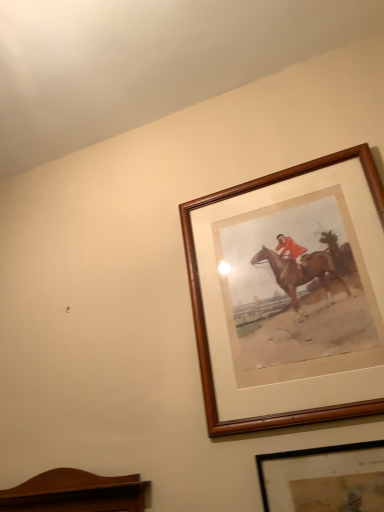
In order to click on black matte picture frame at lower right, positioned as the first picture frame in bottom-to-top order in this screenshot , I will do `click(324, 479)`.

Describe the element at coordinates (324, 479) in the screenshot. I see `black matte picture frame at lower right, acting as the 2th picture frame starting from the top` at that location.

Locate an element on the screen. The width and height of the screenshot is (384, 512). wooden picture frame at upper right, positioned as the second picture frame in bottom-to-top order is located at coordinates (204, 314).

Image resolution: width=384 pixels, height=512 pixels. What do you see at coordinates (204, 314) in the screenshot?
I see `wooden picture frame at upper right, which appears as the 1th picture frame when viewed from the top` at bounding box center [204, 314].

I want to click on black matte picture frame at lower right, acting as the 2th picture frame starting from the top, so click(x=324, y=479).

Is wooden picture frame at upper right, which appears as the 1th picture frame when viewed from the top, at the right side of black matte picture frame at lower right, acting as the 2th picture frame starting from the top?

No, wooden picture frame at upper right, which appears as the 1th picture frame when viewed from the top, is not to the right of black matte picture frame at lower right, acting as the 2th picture frame starting from the top.

Between wooden picture frame at upper right, which appears as the 1th picture frame when viewed from the top, and black matte picture frame at lower right, acting as the 2th picture frame starting from the top, which one is positioned behind?

wooden picture frame at upper right, which appears as the 1th picture frame when viewed from the top.

Is point (380, 206) farther from viewer compared to point (305, 511)?

Yes, point (380, 206) is farther from viewer.

From the image's perspective, which is above, wooden picture frame at upper right, which appears as the 1th picture frame when viewed from the top, or black matte picture frame at lower right, positioned as the first picture frame in bottom-to-top order?

wooden picture frame at upper right, which appears as the 1th picture frame when viewed from the top, from the image's perspective.

From a real-world perspective, who is located higher, wooden picture frame at upper right, positioned as the second picture frame in bottom-to-top order, or black matte picture frame at lower right, positioned as the first picture frame in bottom-to-top order?

From a 3D spatial view, wooden picture frame at upper right, positioned as the second picture frame in bottom-to-top order, is above.

Does wooden picture frame at upper right, which appears as the 1th picture frame when viewed from the top, have a greater width compared to black matte picture frame at lower right, acting as the 2th picture frame starting from the top?

Correct, the width of wooden picture frame at upper right, which appears as the 1th picture frame when viewed from the top, exceeds that of black matte picture frame at lower right, acting as the 2th picture frame starting from the top.

Is wooden picture frame at upper right, which appears as the 1th picture frame when viewed from the top, taller than black matte picture frame at lower right, positioned as the first picture frame in bottom-to-top order?

Correct, wooden picture frame at upper right, which appears as the 1th picture frame when viewed from the top, is much taller as black matte picture frame at lower right, positioned as the first picture frame in bottom-to-top order.

Which of these two, wooden picture frame at upper right, positioned as the second picture frame in bottom-to-top order, or black matte picture frame at lower right, positioned as the first picture frame in bottom-to-top order, is bigger?

With larger size is wooden picture frame at upper right, positioned as the second picture frame in bottom-to-top order.

Is wooden picture frame at upper right, which appears as the 1th picture frame when viewed from the top, inside or outside of black matte picture frame at lower right, acting as the 2th picture frame starting from the top?

wooden picture frame at upper right, which appears as the 1th picture frame when viewed from the top, exists outside the volume of black matte picture frame at lower right, acting as the 2th picture frame starting from the top.

Consider the image. Is wooden picture frame at upper right, positioned as the second picture frame in bottom-to-top order, far away from black matte picture frame at lower right, positioned as the first picture frame in bottom-to-top order?

No, wooden picture frame at upper right, positioned as the second picture frame in bottom-to-top order, is not far from black matte picture frame at lower right, positioned as the first picture frame in bottom-to-top order.

Is wooden picture frame at upper right, positioned as the second picture frame in bottom-to-top order, oriented away from black matte picture frame at lower right, positioned as the first picture frame in bottom-to-top order?

No, wooden picture frame at upper right, positioned as the second picture frame in bottom-to-top order,'s orientation is not away from black matte picture frame at lower right, positioned as the first picture frame in bottom-to-top order.

How different are the orientations of wooden picture frame at upper right, which appears as the 1th picture frame when viewed from the top, and black matte picture frame at lower right, acting as the 2th picture frame starting from the top, in degrees?

0.0104 degrees separate the facing orientations of wooden picture frame at upper right, which appears as the 1th picture frame when viewed from the top, and black matte picture frame at lower right, acting as the 2th picture frame starting from the top.

Where is `picture frame in front of the wooden picture frame at upper right, positioned as the second picture frame in bottom-to-top order`? picture frame in front of the wooden picture frame at upper right, positioned as the second picture frame in bottom-to-top order is located at coordinates (324, 479).

Which object is positioned more to the left, black matte picture frame at lower right, positioned as the first picture frame in bottom-to-top order, or wooden picture frame at upper right, which appears as the 1th picture frame when viewed from the top?

Positioned to the left is wooden picture frame at upper right, which appears as the 1th picture frame when viewed from the top.

Does black matte picture frame at lower right, acting as the 2th picture frame starting from the top, lie behind wooden picture frame at upper right, which appears as the 1th picture frame when viewed from the top?

No, the depth of black matte picture frame at lower right, acting as the 2th picture frame starting from the top, is less than that of wooden picture frame at upper right, which appears as the 1th picture frame when viewed from the top.

Between point (308, 488) and point (209, 374), which one is positioned in front?

The point (308, 488) is more forward.

From the image's perspective, relative to wooden picture frame at upper right, which appears as the 1th picture frame when viewed from the top, is black matte picture frame at lower right, acting as the 2th picture frame starting from the top, above or below?

Based on their image positions, black matte picture frame at lower right, acting as the 2th picture frame starting from the top, is located beneath wooden picture frame at upper right, which appears as the 1th picture frame when viewed from the top.

From a real-world perspective, is black matte picture frame at lower right, positioned as the first picture frame in bottom-to-top order, physically below wooden picture frame at upper right, positioned as the second picture frame in bottom-to-top order?

Indeed, from a real-world perspective, black matte picture frame at lower right, positioned as the first picture frame in bottom-to-top order, is positioned beneath wooden picture frame at upper right, positioned as the second picture frame in bottom-to-top order.

Is black matte picture frame at lower right, positioned as the first picture frame in bottom-to-top order, wider than wooden picture frame at upper right, which appears as the 1th picture frame when viewed from the top?

No.

Can you confirm if black matte picture frame at lower right, acting as the 2th picture frame starting from the top, is taller than wooden picture frame at upper right, positioned as the second picture frame in bottom-to-top order?

No.

Considering the relative sizes of black matte picture frame at lower right, positioned as the first picture frame in bottom-to-top order, and wooden picture frame at upper right, which appears as the 1th picture frame when viewed from the top, in the image provided, is black matte picture frame at lower right, positioned as the first picture frame in bottom-to-top order, smaller than wooden picture frame at upper right, which appears as the 1th picture frame when viewed from the top,?

Yes.

Is black matte picture frame at lower right, positioned as the first picture frame in bottom-to-top order, inside or outside of wooden picture frame at upper right, which appears as the 1th picture frame when viewed from the top?

black matte picture frame at lower right, positioned as the first picture frame in bottom-to-top order, exists outside the volume of wooden picture frame at upper right, which appears as the 1th picture frame when viewed from the top.

Is black matte picture frame at lower right, positioned as the first picture frame in bottom-to-top order, next to wooden picture frame at upper right, positioned as the second picture frame in bottom-to-top order?

black matte picture frame at lower right, positioned as the first picture frame in bottom-to-top order, is not next to wooden picture frame at upper right, positioned as the second picture frame in bottom-to-top order, and they're not touching.

Is black matte picture frame at lower right, positioned as the first picture frame in bottom-to-top order, positioned with its back to wooden picture frame at upper right, which appears as the 1th picture frame when viewed from the top?

No, black matte picture frame at lower right, positioned as the first picture frame in bottom-to-top order,'s orientation is not away from wooden picture frame at upper right, which appears as the 1th picture frame when viewed from the top.

What's the angular difference between black matte picture frame at lower right, positioned as the first picture frame in bottom-to-top order, and wooden picture frame at upper right, positioned as the second picture frame in bottom-to-top order,'s facing directions?

The angular difference between black matte picture frame at lower right, positioned as the first picture frame in bottom-to-top order, and wooden picture frame at upper right, positioned as the second picture frame in bottom-to-top order, is 0.0104 degrees.

How far apart are black matte picture frame at lower right, positioned as the first picture frame in bottom-to-top order, and wooden picture frame at upper right, which appears as the 1th picture frame when viewed from the top?

They are 8.91 inches apart.

Locate an element on the screen. Image resolution: width=384 pixels, height=512 pixels. picture frame above the black matte picture frame at lower right, positioned as the first picture frame in bottom-to-top order (from the image's perspective) is located at coordinates (204, 314).

Find the location of a particular element. The height and width of the screenshot is (512, 384). picture frame to the right of wooden picture frame at upper right, positioned as the second picture frame in bottom-to-top order is located at coordinates (324, 479).

You are a GUI agent. You are given a task and a screenshot of the screen. Output one action in this format:
    pyautogui.click(x=<x>, y=<y>)
    Task: Click on the picture frame that is above the black matte picture frame at lower right, acting as the 2th picture frame starting from the top (from the image's perspective)
    The image size is (384, 512).
    Given the screenshot: What is the action you would take?
    pyautogui.click(x=204, y=314)